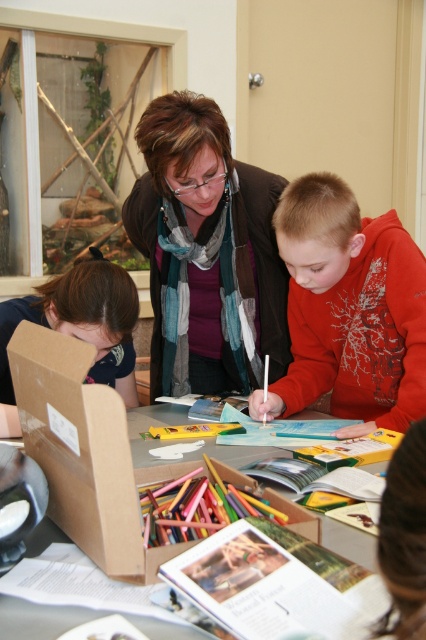
Question: Which of the following is the closest to the observer?

Choices:
 (A) (276, 182)
 (B) (77, 352)
 (C) (377, 362)
 (D) (224, 465)

Answer: (B)

Question: Is brown cardboard box at center smaller than multicolored wax crayons at center?

Choices:
 (A) yes
 (B) no

Answer: (B)

Question: Which point is closer to the camera?

Choices:
 (A) cardboard box at center
 (B) matte brown jacket at center
 (C) brown cardboard box at center
 (D) multicolored wax crayons at center

Answer: (A)

Question: Can you confirm if matte orange hoodie at center is positioned to the right of brown cardboard box at center?

Choices:
 (A) yes
 (B) no

Answer: (A)

Question: Can you confirm if matte brown jacket at center is positioned to the right of multicolored wax crayons at center?

Choices:
 (A) no
 (B) yes

Answer: (A)

Question: Estimate the real-world distances between objects in this image. Which object is farther from the brown cardboard box at center?

Choices:
 (A) multicolored wax crayons at center
 (B) cardboard box at center
 (C) matte orange hoodie at center
 (D) matte brown jacket at center

Answer: (D)